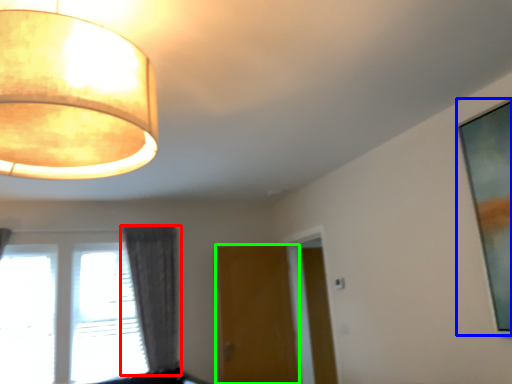
Question: Based on their relative distances, which object is farther from curtain (highlighted by a red box)? Choose from picture frame (highlighted by a blue box) and door (highlighted by a green box).

Choices:
 (A) picture frame
 (B) door

Answer: (A)